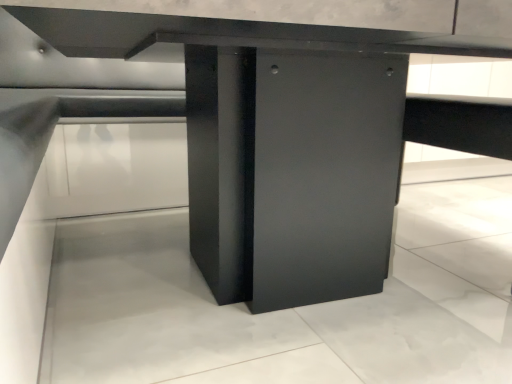
Describe the element at coordinates (288, 309) in the screenshot. The image size is (512, 384). I see `matte black table at center` at that location.

In order to click on matte black table at center in this screenshot , I will do `click(288, 309)`.

The image size is (512, 384). In order to click on matte black table at center in this screenshot , I will do `click(288, 309)`.